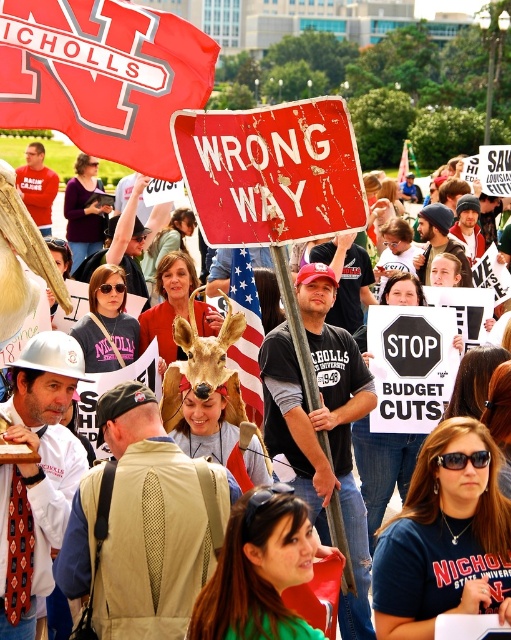
You are a photographer at the protest scene. You want to capture a photo that includes both the rusty metal sign at center and the american flag at center. Based on their positions, which object should you place on the right side of your photo to ensure both are in frame?

You should place the rusty metal sign at center on the right side of your photo since it is already to the right of the american flag at center, ensuring both are included in the frame.